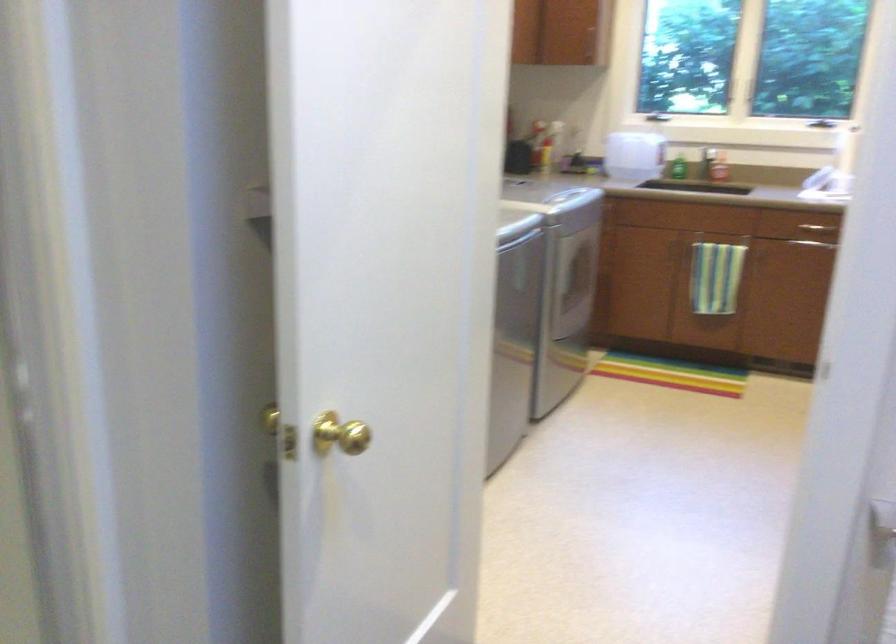
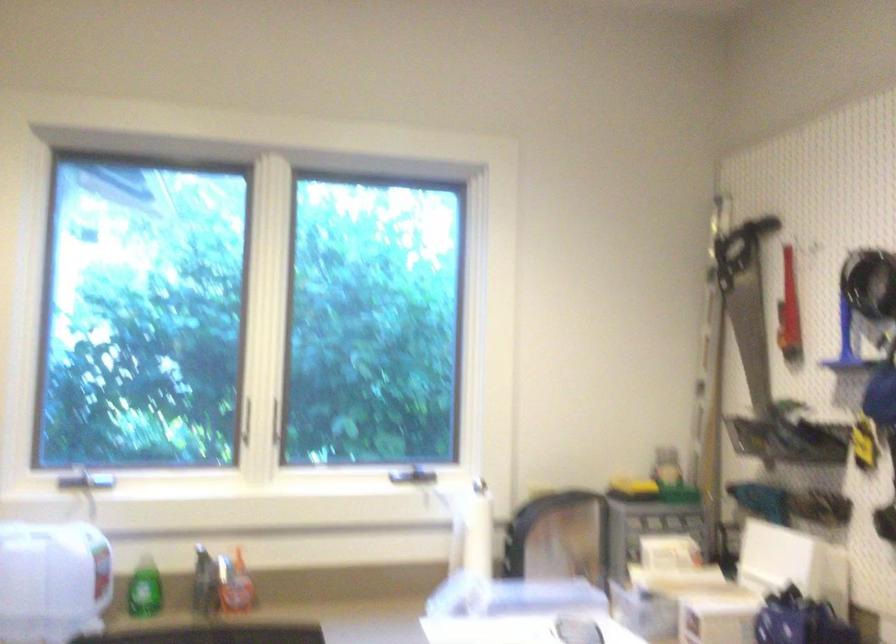
Where in the second image is the point corresponding to [718,162] from the first image?

(234, 583)